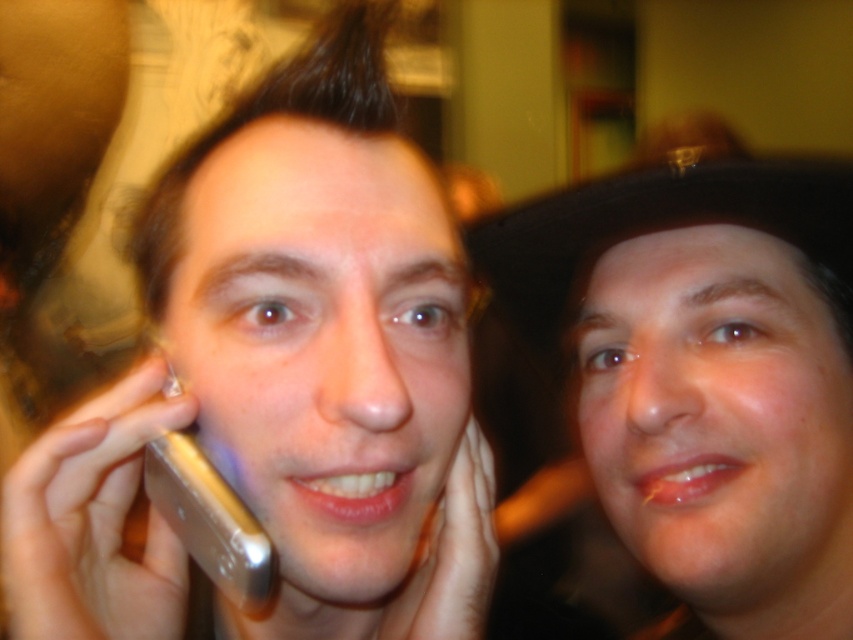
You are a photographer trying to capture the silver metallic phone at left in focus while ensuring the person on the right remains in the background. Given the current depth of field, which is narrow, can you confirm if the silver metallic phone at left will be in focus if you focus at point (283, 380)?

Yes, focusing at point (283, 380) will keep the silver metallic phone at left in focus since the point marks its location. The person on the right will naturally be in the background due to the narrow depth of field.

You are a photographer trying to capture a candid moment between two people. You notice the silver metallic phone at left and the matte black hat at upper right. Which object is taller in the image?

The silver metallic phone at left is taller than the matte black hat at upper right according to the description provided.

You are a photographer using a camera with a 5 inch wide lens. You want to capture both the silver metallic phone at left and the matte black hat at upper right in the same frame. Can you fit both objects within the lens width without moving the camera?

The silver metallic phone at left and matte black hat at upper right are 4.90 inches apart from each other. Since the distance between them is less than the 5 inch lens width, both objects can fit within the lens without moving the camera.